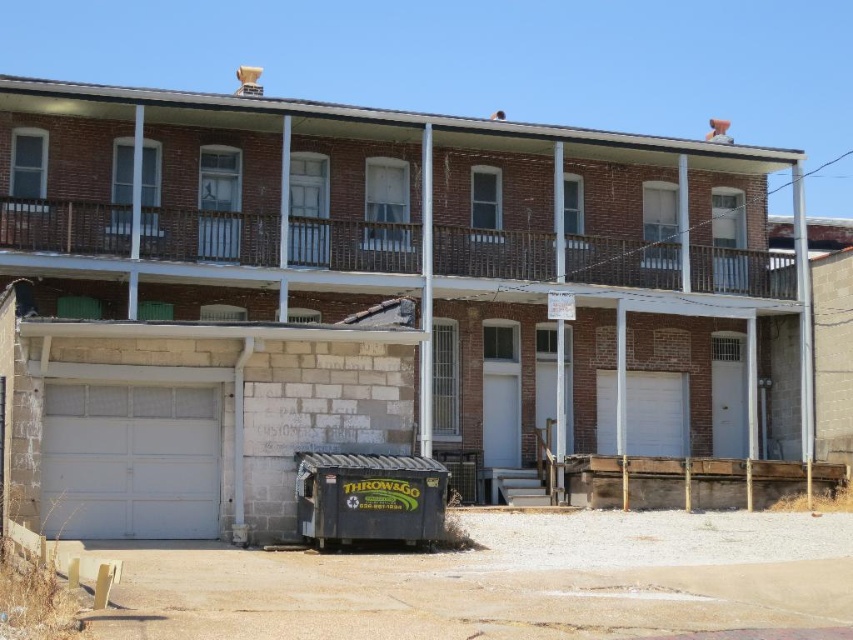
Question: Is white smooth garage door at lower left bigger than white matte garage door at center?

Choices:
 (A) yes
 (B) no

Answer: (B)

Question: Is white matte garage door at lower left to the right of white matte garage door at center from the viewer's perspective?

Choices:
 (A) no
 (B) yes

Answer: (A)

Question: Considering the real-world distances, which object is farthest from the white matte garage door at lower left?

Choices:
 (A) white smooth garage door at lower left
 (B) white matte garage door at center

Answer: (A)

Question: Does white matte garage door at lower left have a larger size compared to white smooth garage door at lower left?

Choices:
 (A) yes
 (B) no

Answer: (A)

Question: Which object is the farthest from the white matte garage door at lower left?

Choices:
 (A) white matte garage door at center
 (B) white smooth garage door at lower left

Answer: (B)

Question: Which point is closer to the camera?

Choices:
 (A) (676, 426)
 (B) (149, 448)
 (C) (192, 484)

Answer: (B)